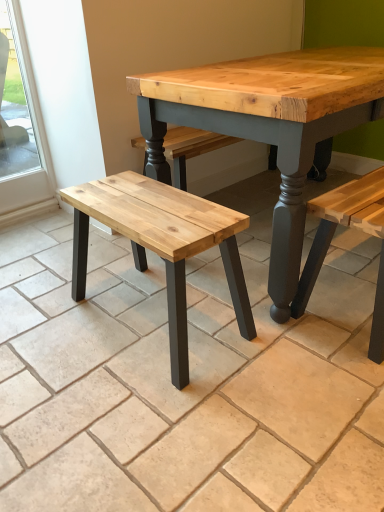
Locate an element on the screen. Image resolution: width=384 pixels, height=512 pixels. vacant region to the left of natural wood bench at left is located at coordinates (51, 321).